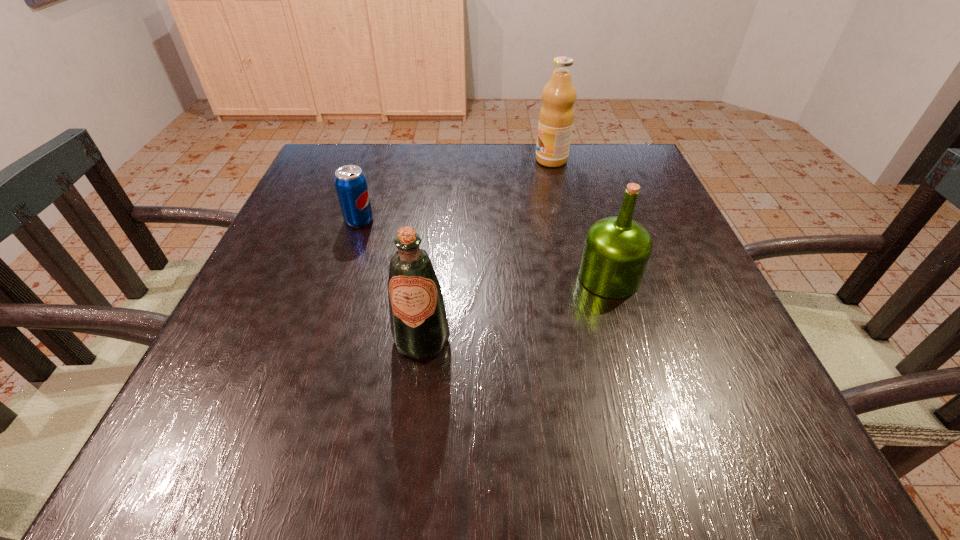
Point out which object is positioned as the third nearest to the second object from left to right. Please provide its 2D coordinates. Your answer should be formatted as a tuple, i.e. [(x, y)], where the tuple contains the x and y coordinates of a point satisfying the conditions above.

[(556, 117)]

Identify which object is the closest to the farthest object. Please provide its 2D coordinates. Your answer should be formatted as a tuple, i.e. [(x, y)], where the tuple contains the x and y coordinates of a point satisfying the conditions above.

[(616, 251)]

Find the location of a particular element. The height and width of the screenshot is (540, 960). olive oil that is the second closest to the leftmost olive oil is located at coordinates (556, 117).

At what (x,y) coordinates should I click in order to perform the action: click on the second closest olive oil to the third farthest object. Please return your answer as a coordinate pair (x, y). The width and height of the screenshot is (960, 540). Looking at the image, I should click on click(556, 117).

Find the location of `vacant space that satisfies the following two spatial constraints: 1. on the label of the farthest olive oil; 2. on the front-facing side of the nearest olive oil`. vacant space that satisfies the following two spatial constraints: 1. on the label of the farthest olive oil; 2. on the front-facing side of the nearest olive oil is located at coordinates (592, 340).

I want to click on vacant space that satisfies the following two spatial constraints: 1. on the back side of the second farthest olive oil; 2. on the label of the farthest object, so click(573, 160).

Locate an element on the screen. free space that satisfies the following two spatial constraints: 1. on the label of the farthest object; 2. on the front side of the pop soda is located at coordinates (565, 220).